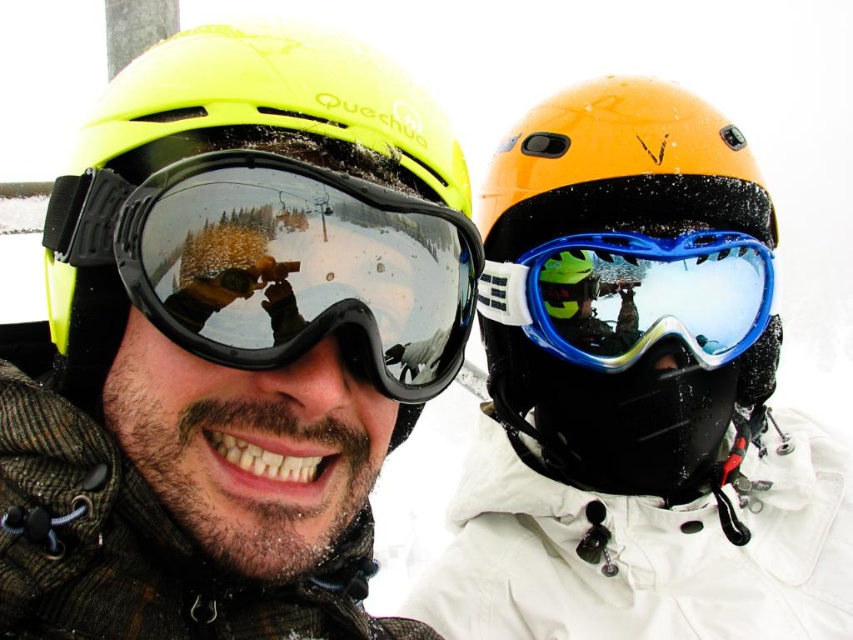
Can you confirm if matte yellow helmet at center is taller than blue glossy ski goggles at center?

Yes, matte yellow helmet at center is taller than blue glossy ski goggles at center.

This screenshot has width=853, height=640. I want to click on matte yellow helmet at center, so click(x=231, y=342).

This screenshot has width=853, height=640. Identify the location of matte yellow helmet at center. (231, 342).

Does orange matte helmet at upper right appear on the left side of blue glossy ski goggles at center?

No, orange matte helmet at upper right is not to the left of blue glossy ski goggles at center.

Who is shorter, orange matte helmet at upper right or blue glossy ski goggles at center?

blue glossy ski goggles at center is shorter.

Between point (543, 148) and point (619, 307), which one is positioned behind?

The point (543, 148) is more distant.

In order to click on orange matte helmet at upper right in this screenshot , I will do `click(622, 285)`.

Does orange matte helmet at upper right appear on the right side of matte black goggles at left?

Yes, orange matte helmet at upper right is to the right of matte black goggles at left.

Who is higher up, orange matte helmet at upper right or matte black goggles at left?

Positioned higher is matte black goggles at left.

Who is more forward, (537, 364) or (99, 195)?

Point (99, 195) is more forward.

At what (x,y) coordinates should I click in order to perform the action: click on orange matte helmet at upper right. Please return your answer as a coordinate pair (x, y). Image resolution: width=853 pixels, height=640 pixels. Looking at the image, I should click on (622, 285).